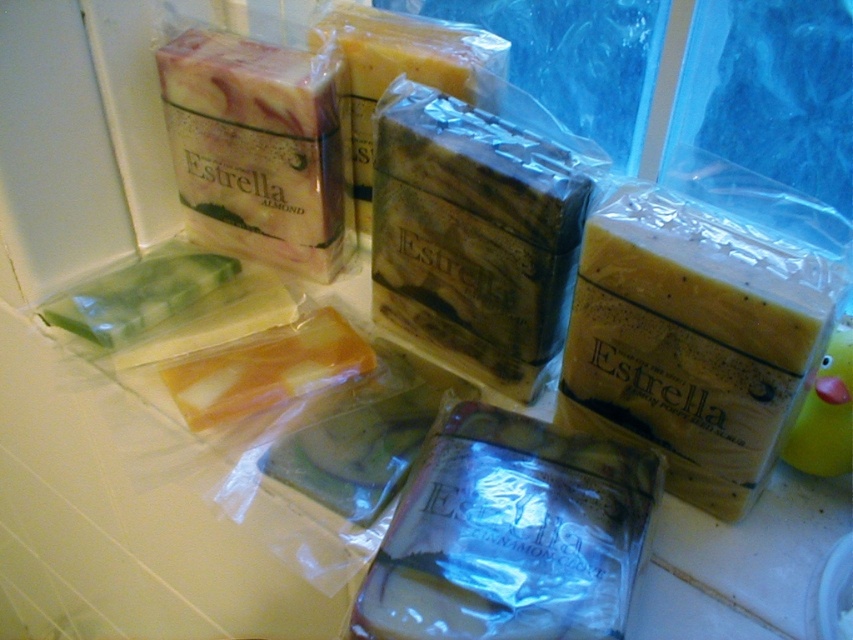
Question: Does yellow matte soap at center come in front of translucent plastic soap at center?

Choices:
 (A) no
 (B) yes

Answer: (A)

Question: Which point is closer to the camera?

Choices:
 (A) (480, 634)
 (B) (624, 248)

Answer: (A)

Question: Does yellow matte soap at center lie behind translucent plastic soap at center?

Choices:
 (A) yes
 (B) no

Answer: (A)

Question: Is yellow matte soap at center positioned in front of translucent plastic soap at center?

Choices:
 (A) no
 (B) yes

Answer: (A)

Question: Which point is farther to the camera?

Choices:
 (A) translucent plastic soap at center
 (B) yellow matte soap at center

Answer: (B)

Question: Among these objects, which one is farthest from the camera?

Choices:
 (A) yellow matte soap at center
 (B) translucent plastic soap at center

Answer: (A)